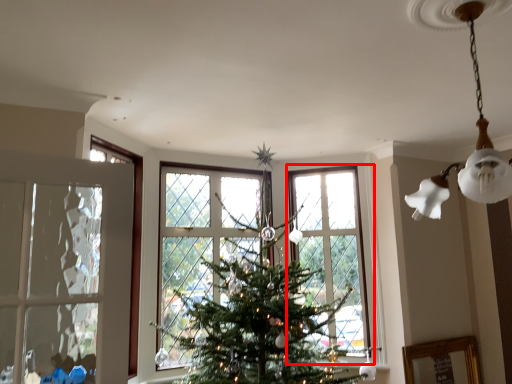
Question: From the image's perspective, what is the correct spatial relationship of window (annotated by the red box) in relation to lamp?

Choices:
 (A) below
 (B) above

Answer: (A)